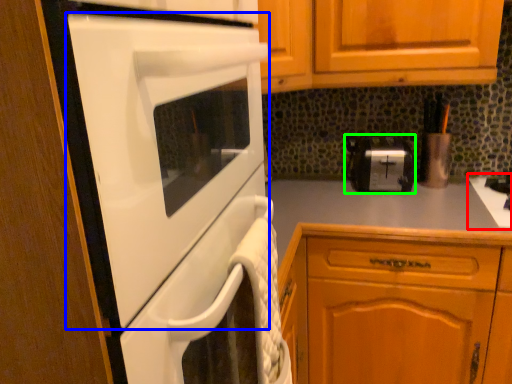
Question: Estimate the real-world distances between objects in this image. Which object is farther from gas stove (highlighted by a red box), home appliance (highlighted by a blue box) or toaster (highlighted by a green box)?

Choices:
 (A) home appliance
 (B) toaster

Answer: (A)